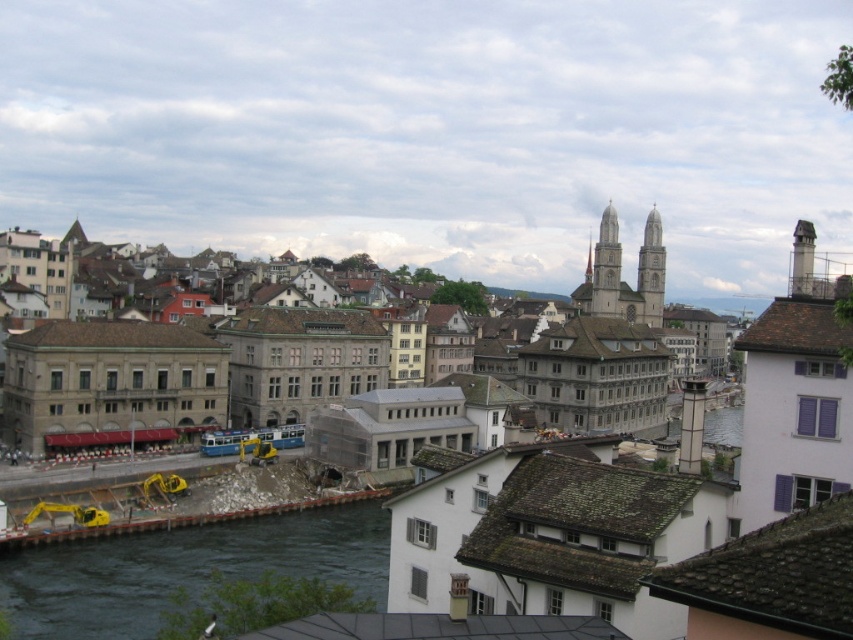
Is point (621, 556) positioned after point (160, 611)?

That is False.

Does matte gray building at center have a lesser height compared to dark blue water at lower left?

Incorrect, matte gray building at center's height does not fall short of dark blue water at lower left's.

The width and height of the screenshot is (853, 640). I want to click on matte gray building at center, so click(556, 540).